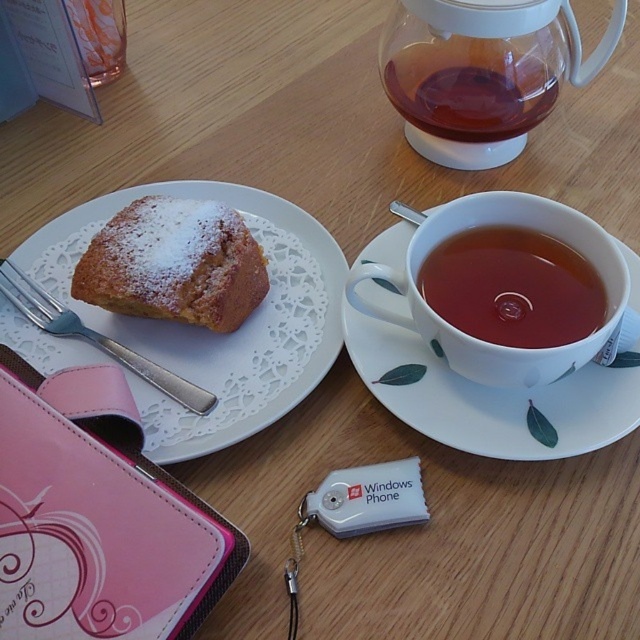
From the picture: Can you confirm if white ceramic saucer at upper right is smaller than brown matte cup at upper center?

No.

Image resolution: width=640 pixels, height=640 pixels. Describe the element at coordinates (490, 397) in the screenshot. I see `white ceramic saucer at upper right` at that location.

You are a GUI agent. You are given a task and a screenshot of the screen. Output one action in this format:
    pyautogui.click(x=<x>, y=<y>)
    Task: Click on the white ceramic saucer at upper right
    
    Given the screenshot: What is the action you would take?
    pyautogui.click(x=490, y=397)

This screenshot has width=640, height=640. What do you see at coordinates (209, 330) in the screenshot? I see `powdered sugar cake at left` at bounding box center [209, 330].

Is the position of powdered sugar cake at left more distant than that of brown matte cup at upper center?

No, it is not.

Does point (273, 236) lie in front of point (586, 321)?

No.

Locate an element on the screen. This screenshot has height=640, width=640. powdered sugar cake at left is located at coordinates (209, 330).

Does powdered sugar cake at left have a lesser width compared to translucent glass teapot at upper center?

In fact, powdered sugar cake at left might be wider than translucent glass teapot at upper center.

Who is positioned more to the left, powdered sugar cake at left or translucent glass teapot at upper center?

powdered sugar cake at left

Locate an element on the screen. This screenshot has height=640, width=640. powdered sugar cake at left is located at coordinates (209, 330).

Find the location of a particular element. powdered sugar cake at left is located at coordinates (209, 330).